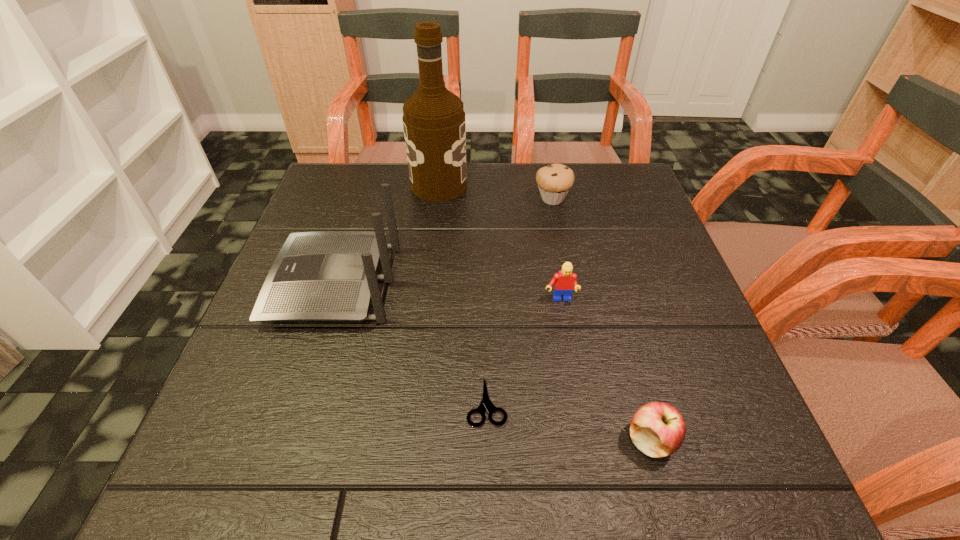
Identify the location of vacant area located on the back of the apple. This screenshot has height=540, width=960. click(x=606, y=281).

Find the location of a particular element. This screenshot has height=540, width=960. free location located on the right of the shears is located at coordinates (585, 401).

Locate an element on the screen. Image resolution: width=960 pixels, height=540 pixels. alcohol present at the far edge is located at coordinates (433, 118).

Identify the location of muffin located at the far edge. The image size is (960, 540). pos(554,181).

The height and width of the screenshot is (540, 960). Identify the location of object located in the near edge section of the desktop. click(x=657, y=429).

At what (x,y) coordinates should I click in order to perform the action: click on object that is positioned at the left edge. Please return your answer as a coordinate pair (x, y). The image size is (960, 540). Looking at the image, I should click on (329, 275).

Find the location of a particular element. The width and height of the screenshot is (960, 540). object that is at the right edge is located at coordinates (657, 429).

Where is `object located at the near right corner`? The image size is (960, 540). object located at the near right corner is located at coordinates (657, 429).

Image resolution: width=960 pixels, height=540 pixels. Find the location of `vacant area at the far edge`. vacant area at the far edge is located at coordinates (388, 165).

I want to click on blank area at the left edge, so click(x=258, y=374).